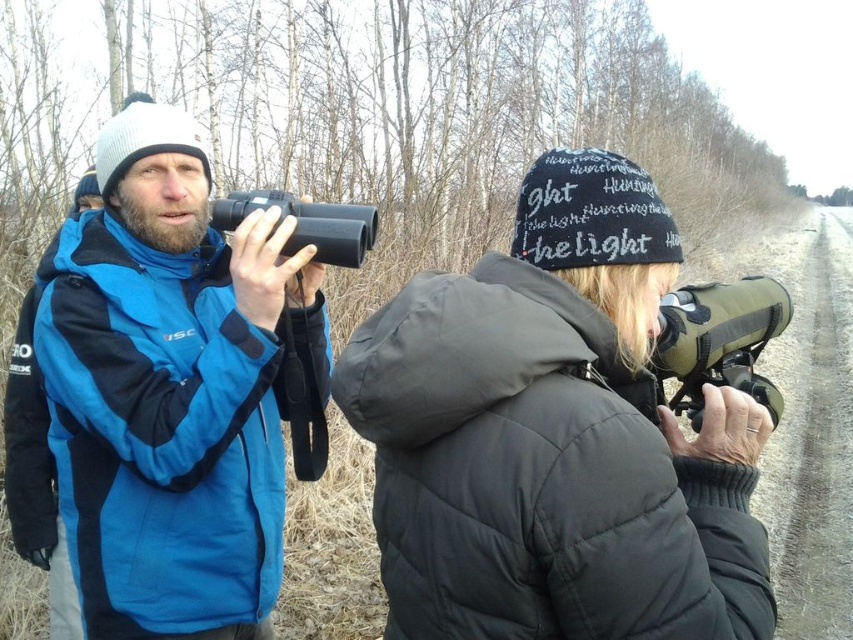
Who is shorter, blue matte jacket at upper left or matte green binoculars at right?

Standing shorter between the two is matte green binoculars at right.

In order to click on blue matte jacket at upper left in this screenshot , I will do `click(170, 388)`.

Is matte black jacket at center below blue matte jacket at upper left?

Yes.

Can you confirm if matte black jacket at center is thinner than blue matte jacket at upper left?

Yes.

I want to click on matte black jacket at center, so point(555,436).

Based on the photo, can you confirm if matte black jacket at center is thinner than black rubber binoculars at left?

No.

Can you confirm if matte black jacket at center is positioned to the right of black rubber binoculars at left?

Indeed, matte black jacket at center is positioned on the right side of black rubber binoculars at left.

Is point (434, 474) less distant than point (337, 234)?

Yes, point (434, 474) is closer to viewer.

Identify the location of matte black jacket at center. (555, 436).